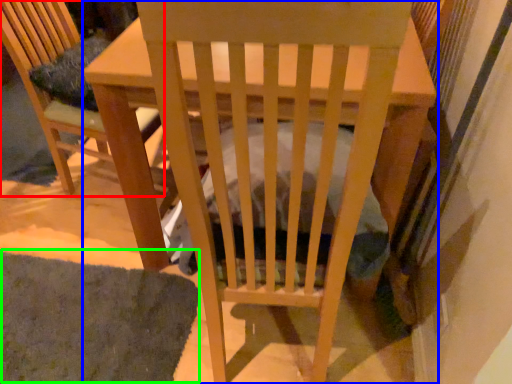
Question: Based on their relative distances, which object is farther from chair (highlighted by a red box)? Choose from table (highlighted by a blue box) and mat (highlighted by a green box).

Choices:
 (A) table
 (B) mat

Answer: (B)